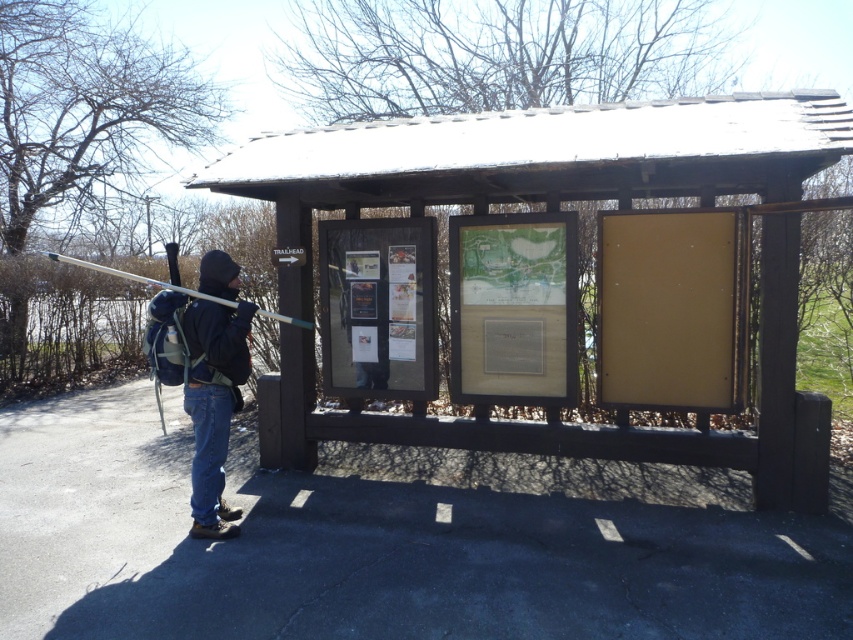
Question: Is wooden signboard at center to the right of black matte jacket at center from the viewer's perspective?

Choices:
 (A) no
 (B) yes

Answer: (B)

Question: Estimate the real-world distances between objects in this image. Which object is closer to the black matte jacket at center?

Choices:
 (A) matte white ski pole at left
 (B) wooden signboard at center

Answer: (A)

Question: Which object is positioned closest to the wooden signboard at center?

Choices:
 (A) black matte jacket at center
 (B) matte white ski pole at left

Answer: (A)

Question: Is wooden signboard at center wider than matte white ski pole at left?

Choices:
 (A) yes
 (B) no

Answer: (B)

Question: Which point appears farthest from the camera in this image?

Choices:
 (A) (548, 188)
 (B) (183, 326)

Answer: (A)

Question: Is wooden signboard at center wider than matte white ski pole at left?

Choices:
 (A) yes
 (B) no

Answer: (B)